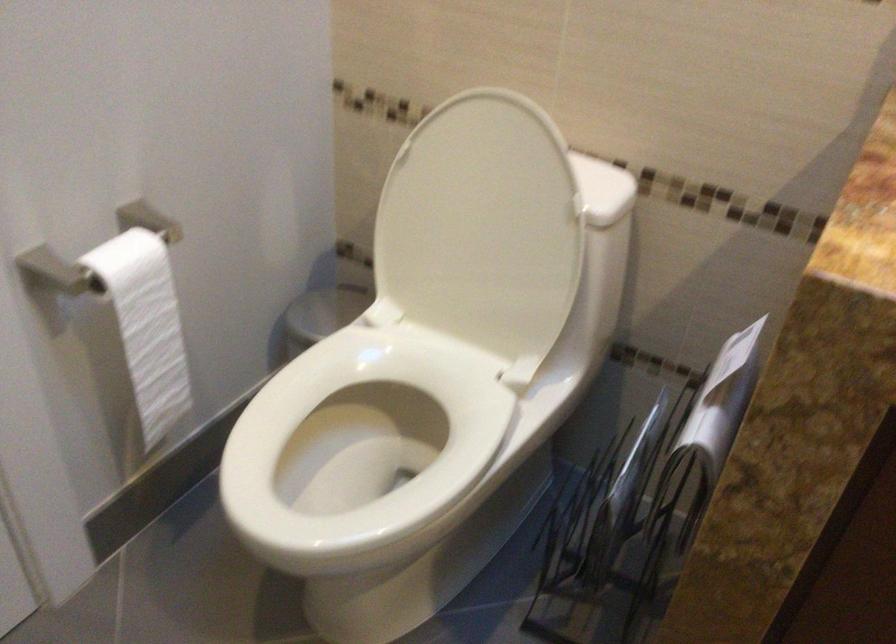
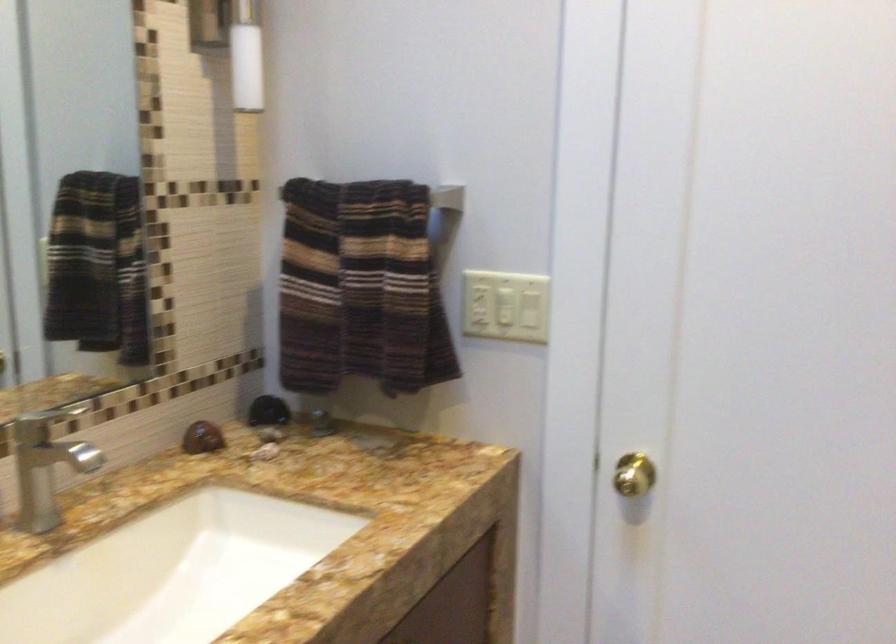
How did the camera likely rotate?

The camera rotated toward right-down.